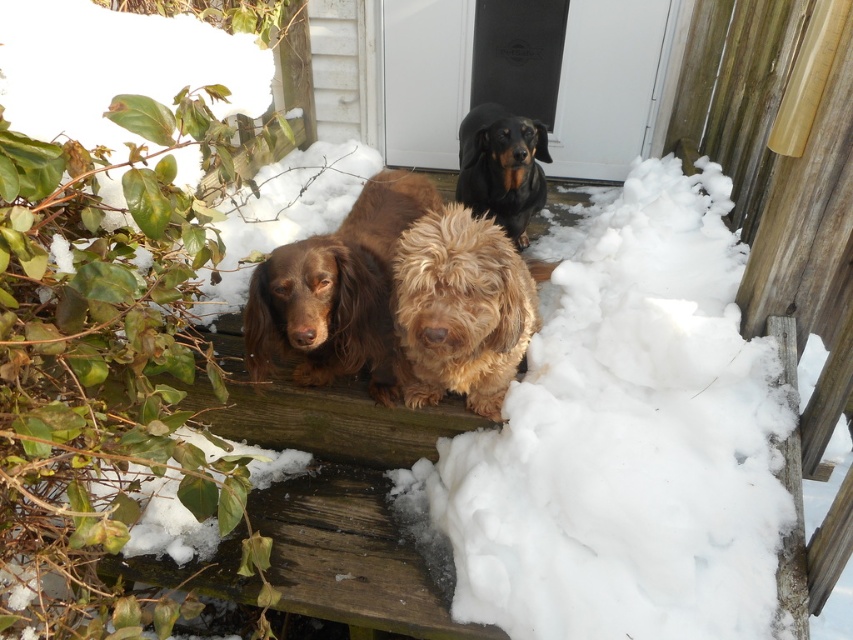
In the snowy scene on the deck, there are two dogs visible. The fuzzy golden dog at center and the black shiny coat at upper center. Which dog is taller?

The black shiny coat at upper center is taller than the fuzzy golden dog at center.

You are a photographer trying to capture a group photo of the brown shaggy dog at center and the white fluffy snow at center. Since you want to ensure both subjects are fully visible in the frame, can you determine if the snow will occupy more space horizontally than the dog?

The white fluffy snow at center has a larger width than the brown shaggy dog at center, so yes, the snow will occupy more horizontal space in the photo than the dog.